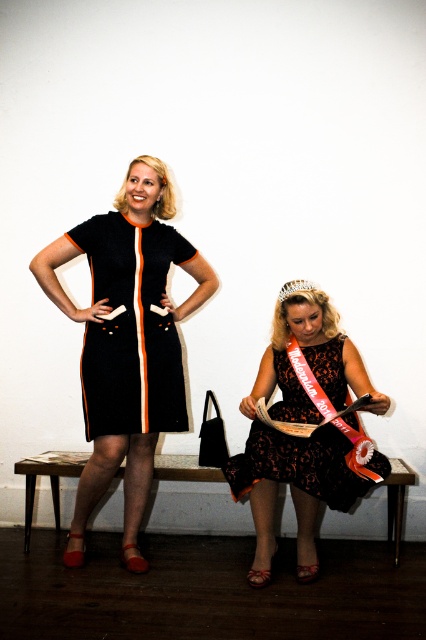
You are a photographer setting up for a photoshoot. You need to ensure that the black matte dress at upper left and the clear crystal tiara at upper center are both visible in the frame. Given their sizes, which object will require more space in the camera frame?

The black matte dress at upper left is bigger than the clear crystal tiara at upper center, so it will require more space in the camera frame.

You are a photographer adjusting your camera to focus on two specific points in the image. The first point is at coordinates point (95, 292) and the second is at point (311, 403). Which point should you focus on first if you want to capture the closest one to the camera?

Point (95, 292) is closer to the viewer than point (311, 403), so you should focus on point (95, 292) first.

You are an artist trying to sketch the scene. You need to place the black matte dress at upper left in your drawing. What coordinates should you use for its position?

The black matte dress at upper left should be placed at coordinates point (131, 328).